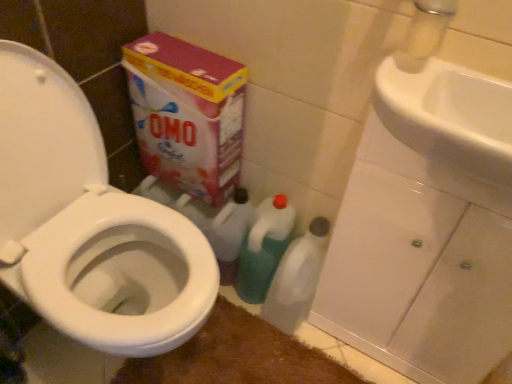
Question: Should I look upward or downward to see transparent plastic bottle at lower center, which appears as the 1th cleaning product when viewed from the right?

Choices:
 (A) down
 (B) up

Answer: (A)

Question: Would you say white glossy sink at upper right contains transparent plastic bottle at lower center, positioned as the 2th cleaning product in left-to-right order?

Choices:
 (A) no
 (B) yes

Answer: (A)

Question: Is white glossy sink at upper right to the right of transparent plastic bottle at lower center, positioned as the 2th cleaning product in left-to-right order, from the viewer's perspective?

Choices:
 (A) no
 (B) yes

Answer: (B)

Question: From the image's perspective, is white glossy sink at upper right below transparent plastic bottle at lower center, which appears as the 1th cleaning product when viewed from the right?

Choices:
 (A) yes
 (B) no

Answer: (B)

Question: Considering the relative sizes of white glossy sink at upper right and transparent plastic bottle at lower center, positioned as the 2th cleaning product in left-to-right order, in the image provided, is white glossy sink at upper right wider than transparent plastic bottle at lower center, positioned as the 2th cleaning product in left-to-right order,?

Choices:
 (A) no
 (B) yes

Answer: (B)

Question: Is white glossy sink at upper right to the left of transparent plastic bottle at lower center, which appears as the 1th cleaning product when viewed from the right, from the viewer's perspective?

Choices:
 (A) no
 (B) yes

Answer: (A)

Question: Would you say white glossy sink at upper right is outside transparent plastic bottle at lower center, positioned as the 2th cleaning product in left-to-right order?

Choices:
 (A) yes
 (B) no

Answer: (A)

Question: From a real-world perspective, is white glossy toilet at left located higher than brown plush bath mat at lower center?

Choices:
 (A) no
 (B) yes

Answer: (B)

Question: From a real-world perspective, is white glossy toilet at left below brown plush bath mat at lower center?

Choices:
 (A) yes
 (B) no

Answer: (B)

Question: From the image's perspective, is white glossy toilet at left on brown plush bath mat at lower center?

Choices:
 (A) yes
 (B) no

Answer: (A)

Question: Considering the relative positions of white glossy toilet at left and brown plush bath mat at lower center in the image provided, is white glossy toilet at left behind brown plush bath mat at lower center?

Choices:
 (A) yes
 (B) no

Answer: (B)

Question: Is white glossy toilet at left far away from brown plush bath mat at lower center?

Choices:
 (A) yes
 (B) no

Answer: (B)

Question: Can you confirm if white glossy toilet at left is smaller than brown plush bath mat at lower center?

Choices:
 (A) yes
 (B) no

Answer: (B)

Question: Does transparent plastic bottle at lower center, which appears as the 1th cleaning product when viewed from the right, turn towards brown plush bath mat at lower center?

Choices:
 (A) no
 (B) yes

Answer: (B)